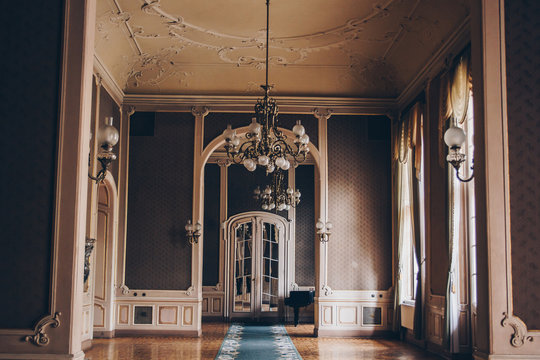
Locate an element on the screen. This screenshot has width=540, height=360. curtains is located at coordinates (450, 267), (403, 253).